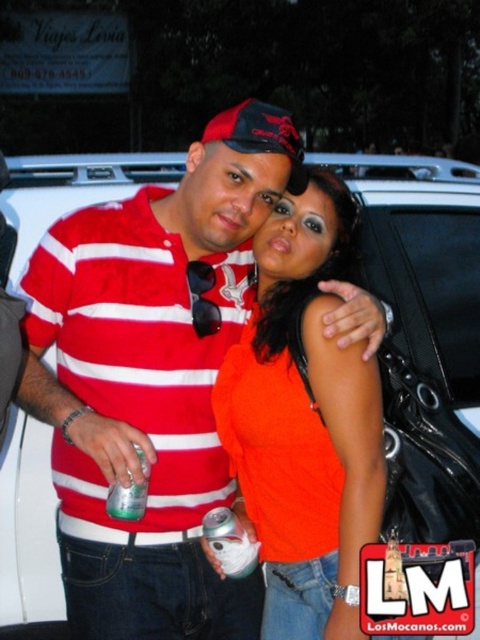
You are a photographer trying to capture a closeup of the green translucent can at center without the matte orange shirt at center blocking it. Based on their positions, can you adjust the camera angle to ensure the can is fully visible?

The matte orange shirt at center might be wider than the green translucent can at center, so adjusting the camera angle slightly to the side could help avoid the shirt blocking the can.

You are taking a photo of two people and notice two green cans in the background. Which can, the green matte can at center or the green translucent can at center, is closer to the camera?

The green matte can at center is closer to the camera than the green translucent can at center according to the description.

You are a photographer standing between two people in the scene. The person on the left is wearing a red and white horizontally striped polo shirt, and the person on the right is wearing a matte orange shirt at center. If you want to take a group photo that includes both of them without moving anyone, what is the minimum distance you need to step back from your current position?

The minimum distance you need to step back is 1.56 meters to include both the person on the left wearing the red and white horizontally striped polo shirt and the person on the right wearing the matte orange shirt at center in the photo without moving them.